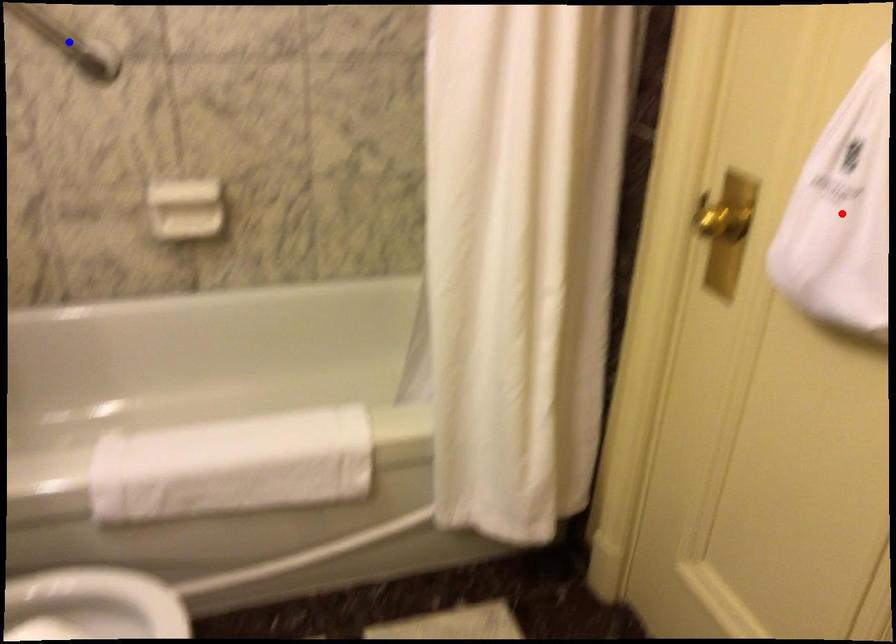
Question: Two points are marked on the image. Which point is closer to the camera?

Choices:
 (A) Blue point is closer.
 (B) Red point is closer.

Answer: (B)